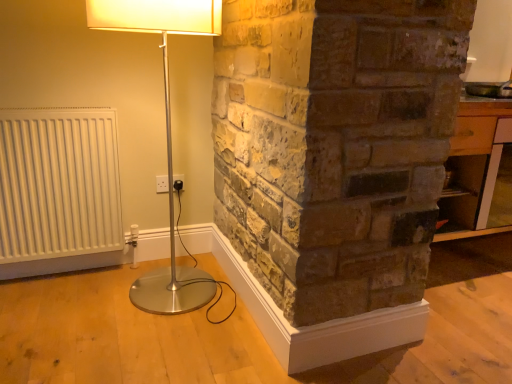
Where is `free space in front of silver metallic floor lamp at left`? This screenshot has height=384, width=512. free space in front of silver metallic floor lamp at left is located at coordinates (138, 357).